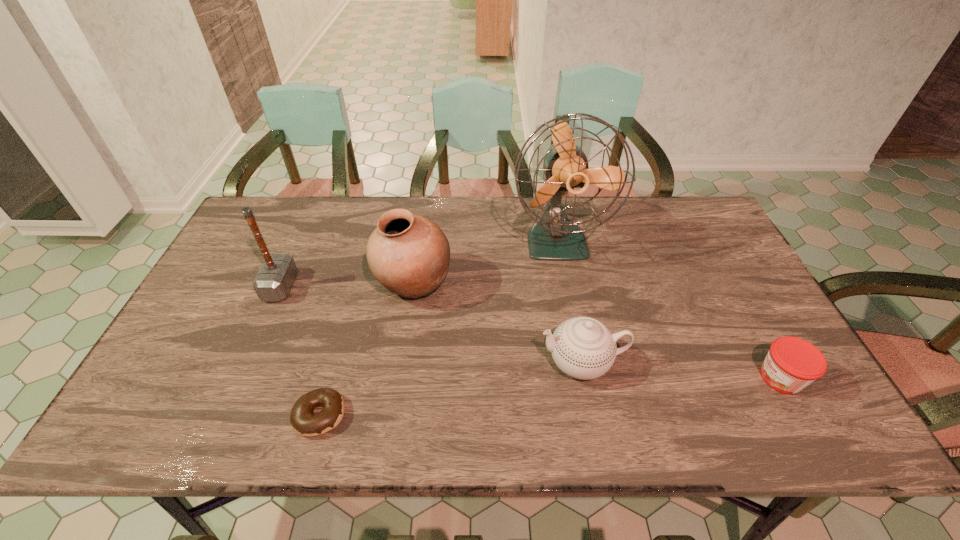
Where is `free point located on the spout of the fourth tallest object`? This screenshot has height=540, width=960. free point located on the spout of the fourth tallest object is located at coordinates (453, 362).

You are a GUI agent. You are given a task and a screenshot of the screen. Output one action in this format:
    pyautogui.click(x=<x>, y=<y>)
    Task: Click on the vacant space located on the spout of the fourth tallest object
    This screenshot has width=960, height=540.
    Given the screenshot: What is the action you would take?
    pyautogui.click(x=389, y=362)

Image resolution: width=960 pixels, height=540 pixels. Find the location of `free space located 0.350m on the spout of the fourth tallest object`. free space located 0.350m on the spout of the fourth tallest object is located at coordinates pos(396,362).

Locate an element on the screen. The image size is (960, 540). blank space located 0.400m on the label side of the jam is located at coordinates (589, 377).

Locate an element on the screen. vacant region located on the label side of the jam is located at coordinates (699, 377).

At what (x,y) coordinates should I click in order to perform the action: click on free space located on the label side of the jam. Please return your answer as a coordinate pair (x, y). Looking at the image, I should click on (628, 377).

At what (x,y) coordinates should I click in order to perform the action: click on vacant space located on the back of the doughnut. Please return your answer as a coordinate pair (x, y). This screenshot has width=960, height=540. Looking at the image, I should click on (350, 306).

At what (x,y) coordinates should I click in order to perform the action: click on object located in the far edge section of the desktop. Please return your answer as a coordinate pair (x, y). Looking at the image, I should click on (554, 237).

Where is `object situated at the near edge`? object situated at the near edge is located at coordinates (302, 418).

Locate an element on the screen. object present at the right edge is located at coordinates (x=792, y=363).